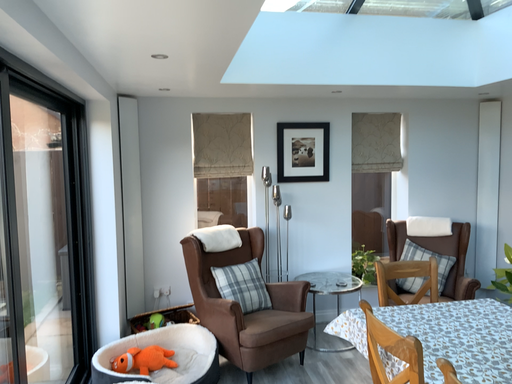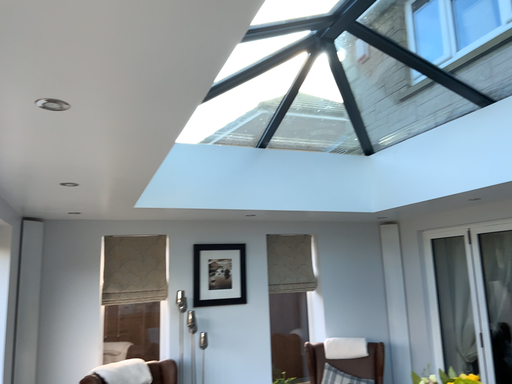
Question: How did the camera likely rotate when shooting the video?

Choices:
 (A) rotated right
 (B) rotated left

Answer: (A)